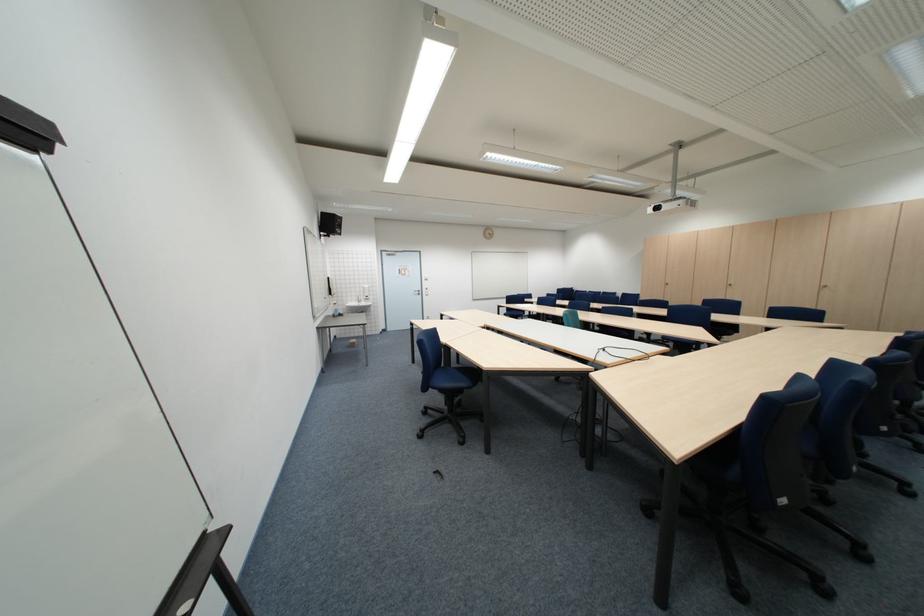
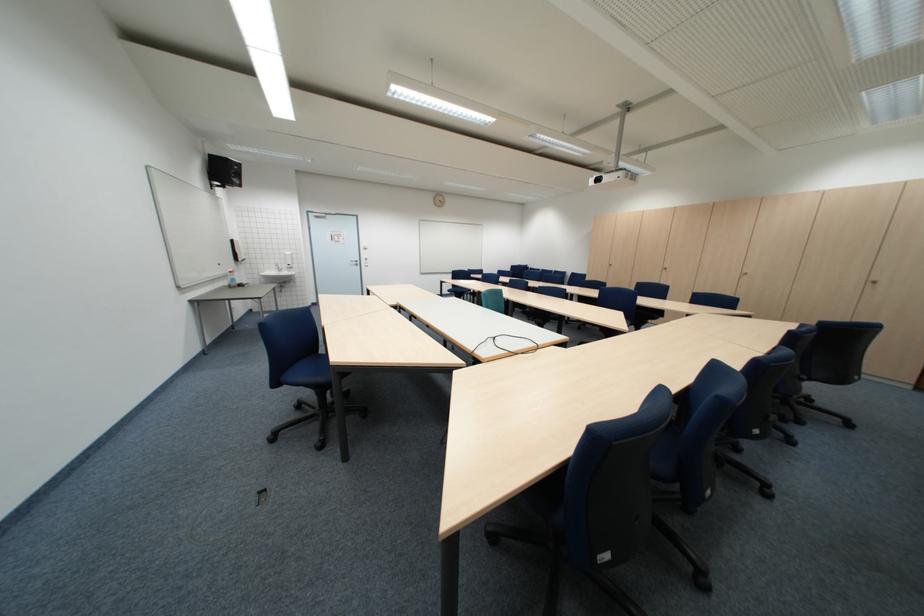
In a continuous first-person perspective shot, in which direction is the camera moving?

The cameraman walked toward right, forward.